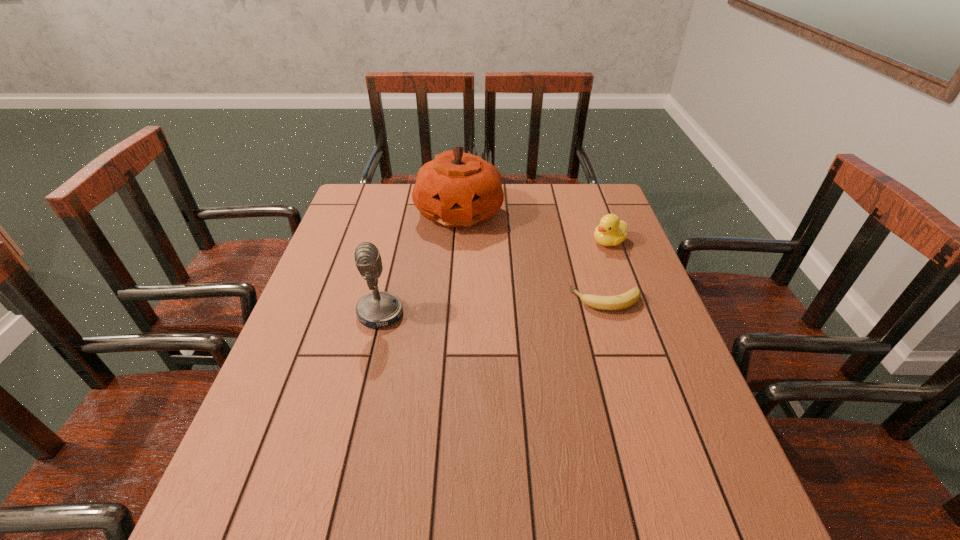
In the image, there is a desktop. Find the location of `vacant space at the near edge`. vacant space at the near edge is located at coordinates (441, 458).

At what (x,y) coordinates should I click in order to perform the action: click on vacant area at the left edge of the desktop. Please return your answer as a coordinate pair (x, y). Looking at the image, I should click on (336, 239).

Find the location of `vacant region at the right edge`. vacant region at the right edge is located at coordinates (669, 386).

The image size is (960, 540). In the image, there is a desktop. Find the location of `free space at the near left corner`. free space at the near left corner is located at coordinates (262, 458).

In the image, there is a desktop. Where is `blank space at the far right corner`? This screenshot has height=540, width=960. blank space at the far right corner is located at coordinates (601, 213).

This screenshot has height=540, width=960. What are the coordinates of `vacant space at the near right corner of the desktop` in the screenshot? It's located at (720, 450).

Locate an element on the screen. The width and height of the screenshot is (960, 540). vacant space that's between the microphone and the duckling is located at coordinates (494, 278).

At what (x,y) coordinates should I click in order to perform the action: click on blank region between the microphone and the banana. Please return your answer as a coordinate pair (x, y). Image resolution: width=960 pixels, height=540 pixels. Looking at the image, I should click on (493, 307).

Where is `vacant area that lies between the second shortest object and the pumpkin`? vacant area that lies between the second shortest object and the pumpkin is located at coordinates (535, 227).

The height and width of the screenshot is (540, 960). I want to click on free space that is in between the pumpkin and the duckling, so click(x=535, y=227).